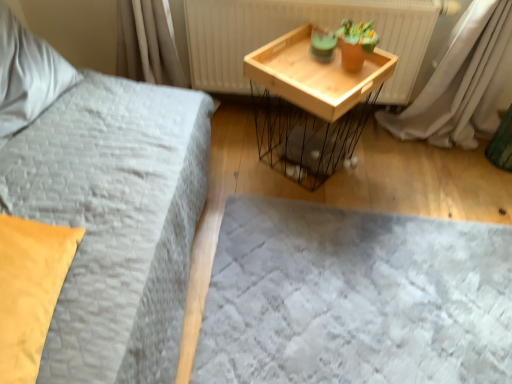
Question: Is point (44, 278) positioned closer to the camera than point (188, 26)?

Choices:
 (A) closer
 (B) farther

Answer: (A)

Question: Is matte yellow pillow at left, positioned as the first pillow in front-to-back order, inside or outside of wooden tray at upper right?

Choices:
 (A) inside
 (B) outside

Answer: (B)

Question: Estimate the real-world distances between objects in this image. Which object is farther from the soft gray fabric bed frame at lower center?

Choices:
 (A) matte yellow pillow at left, which is the second pillow in back-to-front order
 (B) soft white pillow at upper left, the second pillow from the front
 (C) wooden tray at center
 (D) wooden tray at upper right

Answer: (B)

Question: Estimate the real-world distances between objects in this image. Which object is farther from the soft gray fabric bed frame at lower center?

Choices:
 (A) wooden tray at upper right
 (B) matte yellow pillow at left, which is counted as the second pillow, starting from the left
 (C) wooden tray at center
 (D) soft white pillow at upper left, the second pillow from the front

Answer: (D)